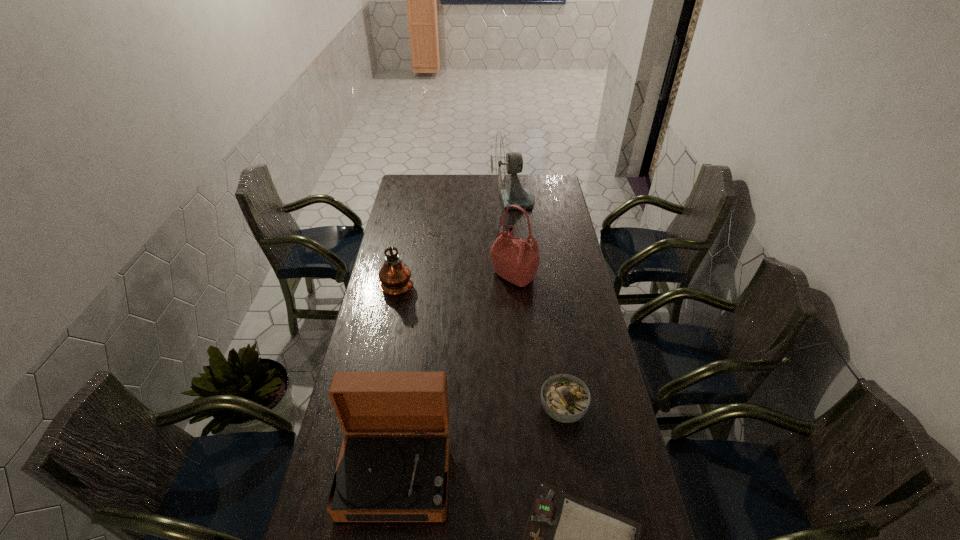
The height and width of the screenshot is (540, 960). I want to click on the farthest object, so click(x=503, y=162).

At what (x,y) coordinates should I click in order to perform the action: click on handbag. Please return your answer as a coordinate pair (x, y). Looking at the image, I should click on (515, 260).

You are a GUI agent. You are given a task and a screenshot of the screen. Output one action in this format:
    pyautogui.click(x=<x>, y=<y>)
    Task: Click on the oil lamp
    
    Given the screenshot: What is the action you would take?
    pyautogui.click(x=395, y=276)

Where is `phonograph record`? phonograph record is located at coordinates (379, 478).

The width and height of the screenshot is (960, 540). In order to click on soup bowl in this screenshot , I will do `click(565, 398)`.

The image size is (960, 540). I want to click on free space located 0.380m in front of the farthest object to blow air, so click(x=420, y=201).

Image resolution: width=960 pixels, height=540 pixels. Identify the location of vacant space located in front of the farthest object to blow air. (419, 201).

This screenshot has height=540, width=960. I want to click on vacant space located in front of the farthest object to blow air, so click(x=439, y=201).

This screenshot has width=960, height=540. I want to click on free space located on the right of the handbag, so click(573, 275).

Image resolution: width=960 pixels, height=540 pixels. Identify the location of free point located on the back of the oil lamp. (408, 231).